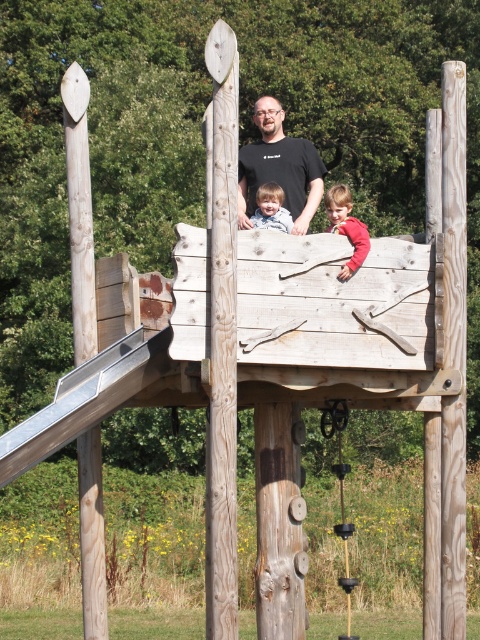
You are a parent standing near the natural wood pole at left and want to watch your child playing near the matte black shirt at center. Can you see them clearly from your position?

The natural wood pole at left is further to the viewer than the matte black shirt at center, so you are closer to the pole and farther from the child. This might make it harder to see them clearly.

Based on the photo, you are standing at the base of the play structure and see the natural wood pole at center and the smooth beige shirt at center. From your perspective, which object is positioned to the left?

The natural wood pole at center is to the left of the smooth beige shirt at center.

You are a painter who wants to wrap a ribbon around the natural wood pole at center and the smooth beige shirt at center. Which object would require a longer ribbon? Please explain your reasoning.

The natural wood pole at center might be wider than smooth beige shirt at center, so it would require a longer ribbon to wrap around.